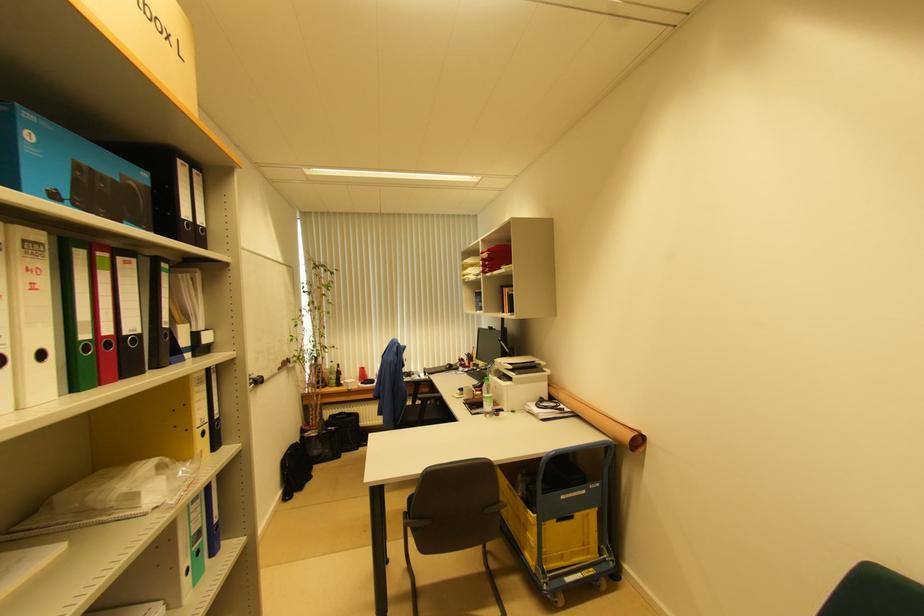
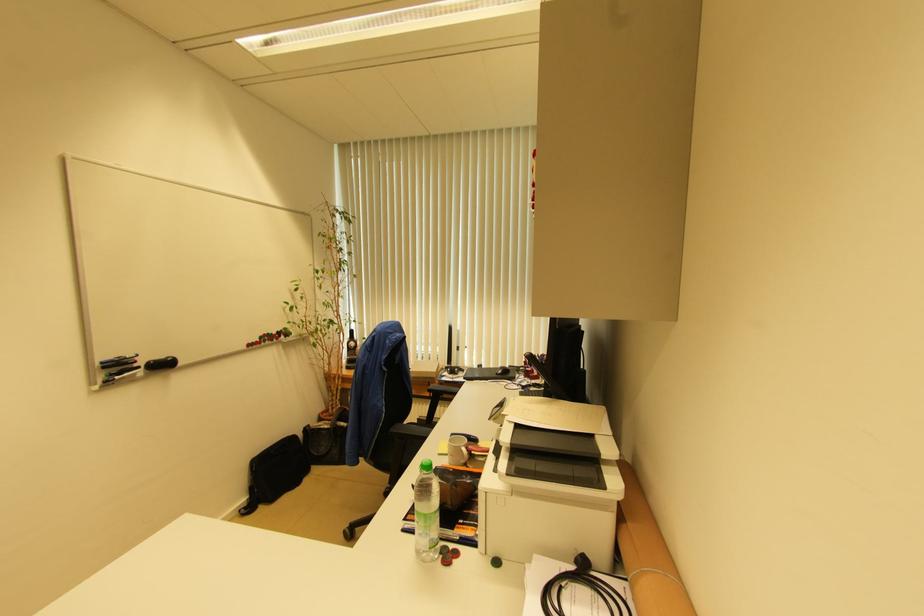
In a continuous first-person perspective shot, in which direction is the camera moving?

The movement direction of the cameraman is right, forward.